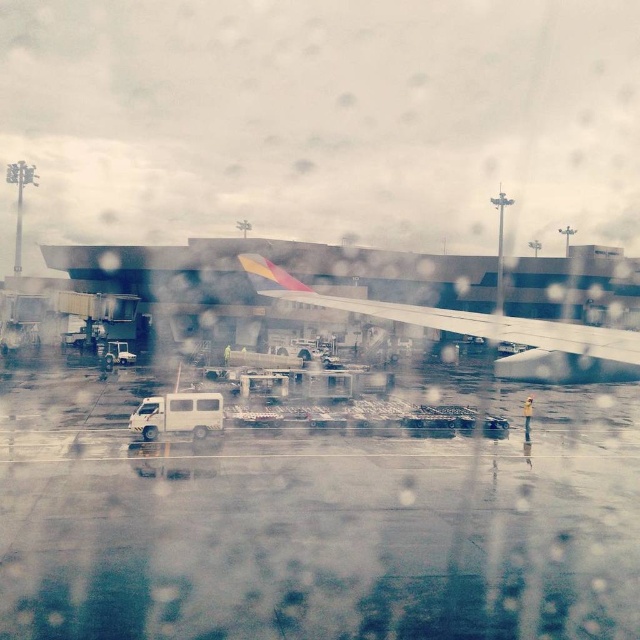
Question: Is white matte van at center wider than white glossy van at center?

Choices:
 (A) yes
 (B) no

Answer: (B)

Question: Based on their relative distances, which object is farther from the white rubber tarmac at center?

Choices:
 (A) transparent glass airplane window at center
 (B) white glossy van at center
 (C) metallic silver wing at center
 (D) white matte van at center

Answer: (B)

Question: Is white rubber tarmac at center wider than white matte van at center?

Choices:
 (A) no
 (B) yes

Answer: (B)

Question: Which object appears farthest from the camera in this image?

Choices:
 (A) transparent glass airplane window at center
 (B) white matte van at center

Answer: (A)

Question: Which point is closer to the camera?

Choices:
 (A) (305, 570)
 (B) (148, 410)
 (C) (310, 301)

Answer: (A)

Question: Is transparent glass airplane window at center thinner than white glossy van at center?

Choices:
 (A) yes
 (B) no

Answer: (A)